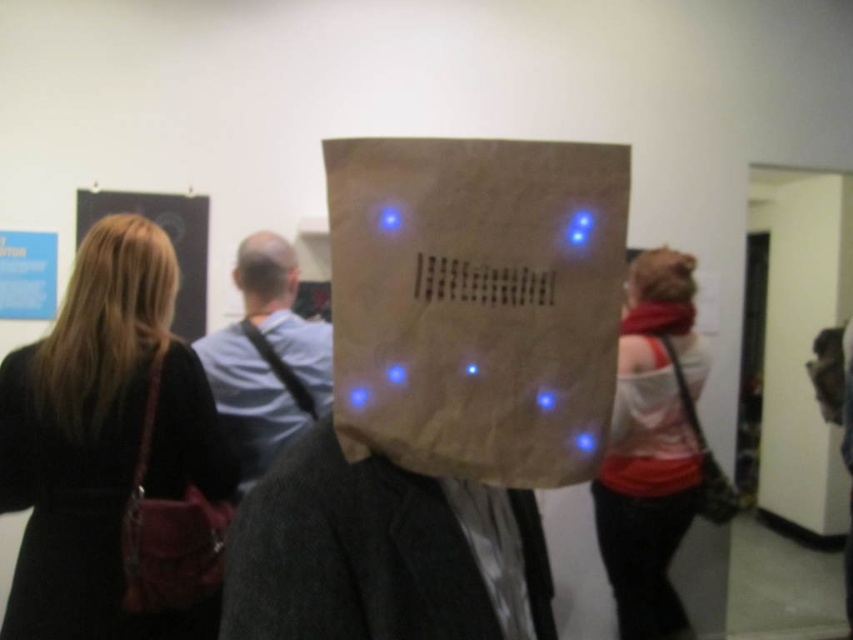
Measure the distance from blonde hair at left to smooth bald head at center.

blonde hair at left and smooth bald head at center are 16.07 inches apart from each other.

Who is higher up, blonde hair at left or smooth bald head at center?

smooth bald head at center is higher up.

This screenshot has width=853, height=640. Find the location of `blonde hair at left`. blonde hair at left is located at coordinates (120, 280).

Between point (132, 276) and point (642, 307), which one is positioned in front?

Point (132, 276)

Does blonde hair at left lie behind red scarf at upper right?

No, blonde hair at left is closer to the viewer.

Describe the element at coordinates (120, 280) in the screenshot. I see `blonde hair at left` at that location.

At what (x,y) coordinates should I click in order to perform the action: click on blonde hair at left. Please return your answer as a coordinate pair (x, y). The image size is (853, 640). Looking at the image, I should click on (120, 280).

Does black leather coat at left have a greater width compared to brown paper bag at right?

Yes.

The image size is (853, 640). What do you see at coordinates (114, 456) in the screenshot?
I see `black leather coat at left` at bounding box center [114, 456].

This screenshot has width=853, height=640. I want to click on black leather coat at left, so click(x=114, y=456).